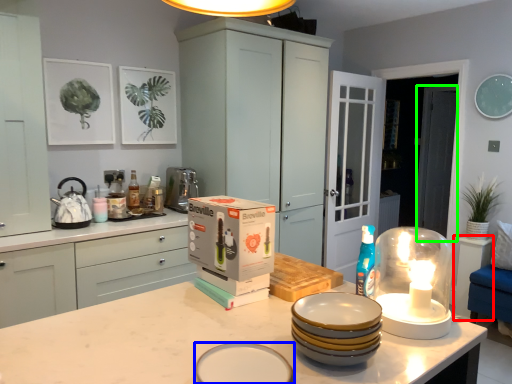
Question: Considering the real-world distances, which object is farthest from table (highlighted by a red box)? tableware (highlighted by a blue box) or glass door (highlighted by a green box)?

Choices:
 (A) tableware
 (B) glass door

Answer: (A)